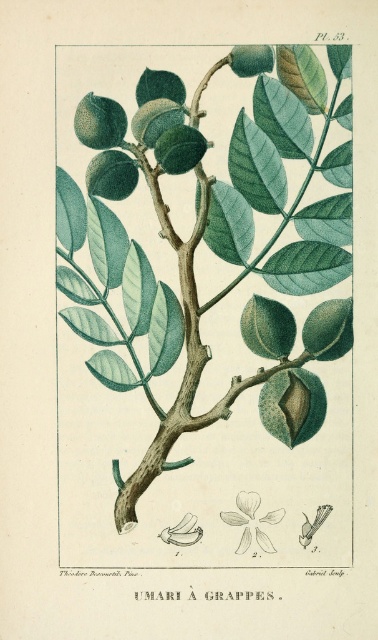
Question: Is green matte leaves at center smaller than white paper-like at center?

Choices:
 (A) yes
 (B) no

Answer: (B)

Question: Is green matte leaves at center thinner than white paper-like flower at center?

Choices:
 (A) no
 (B) yes

Answer: (A)

Question: Does white paper-like flower at center have a greater width compared to white paper-like at center?

Choices:
 (A) yes
 (B) no

Answer: (A)

Question: Which point appears farthest from the camera in this image?

Choices:
 (A) (272, 513)
 (B) (182, 541)
 (C) (204, 154)

Answer: (C)

Question: Which point is closer to the camera?

Choices:
 (A) (167, 538)
 (B) (252, 493)
 (C) (269, 86)

Answer: (C)

Question: Estimate the real-world distances between objects in this image. Which object is closer to the white paper-like at center?

Choices:
 (A) white paper-like flower at center
 (B) green matte leaves at center

Answer: (A)